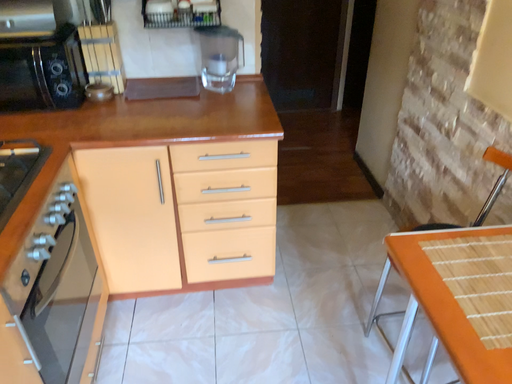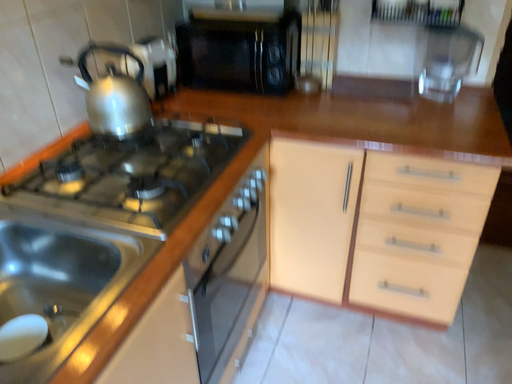
Question: Which way did the camera rotate in the video?

Choices:
 (A) rotated right
 (B) rotated left

Answer: (B)